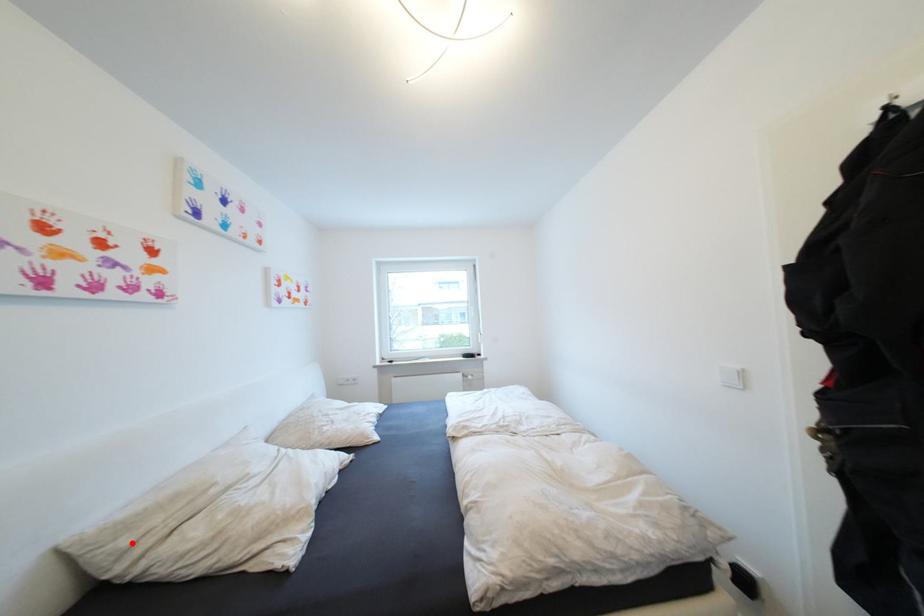
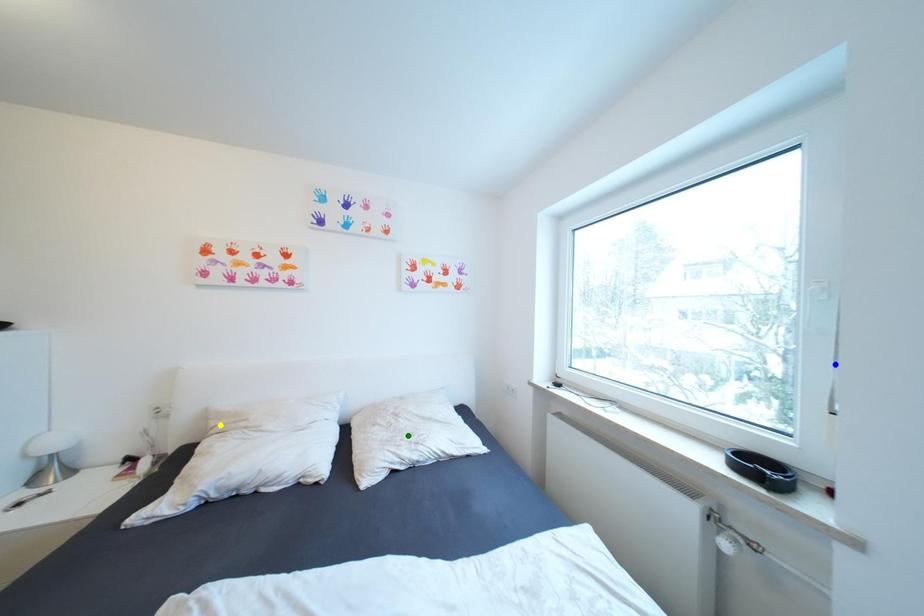
Question: I am providing you with two images of the same scene from different viewpoints. A red point is marked on the first image. You are given multiple points on the second image. Can you choose the point in image 2 that corresponds to the point in image 1?

Choices:
 (A) yellow point
 (B) blue point
 (C) green point

Answer: (A)